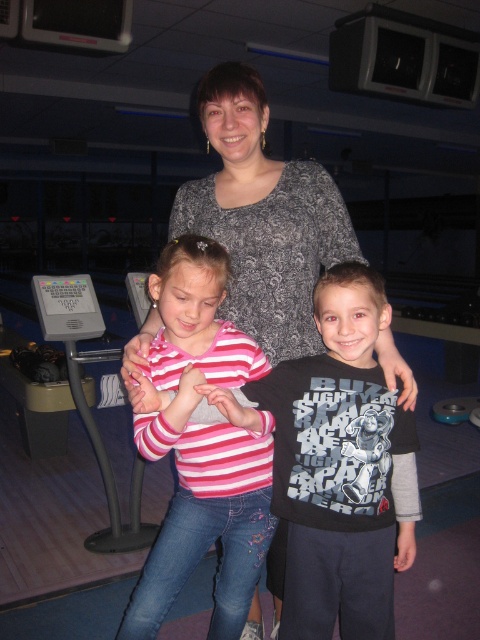
Based on the photo, you are standing at the entrance of the bowling alley and want to approach the group of three people near the center. The point you need to reach is marked at coordinates point (276, 387). If you can walk 1.5 meters per second, how many seconds will it take you to reach that point?

The distance between you and point (276, 387) is 1.44 meters. At a walking speed of 1.5 meters per second, it would take approximately 0.96 seconds to reach the point.

You are a photographer trying to capture a group photo of the family in the bowling alley. You need to ensure that both the pink striped shirt at center and the dark gray textured sweater at center are clearly visible. Based on their sizes, which clothing item might you need to adjust the camera focus on to ensure it stands out more?

The pink striped shirt at center has a smaller size compared to the dark gray textured sweater at center, so adjusting the camera focus on the pink striped shirt at center would help it stand out more due to its smaller size.

You are a photographer trying to capture a family photo in the bowling alley. You notice the black cotton shirt at center and the dark gray textured sweater at center. Which one is positioned to the right of the other?

The black cotton shirt at center is to the right of the dark gray textured sweater at center.